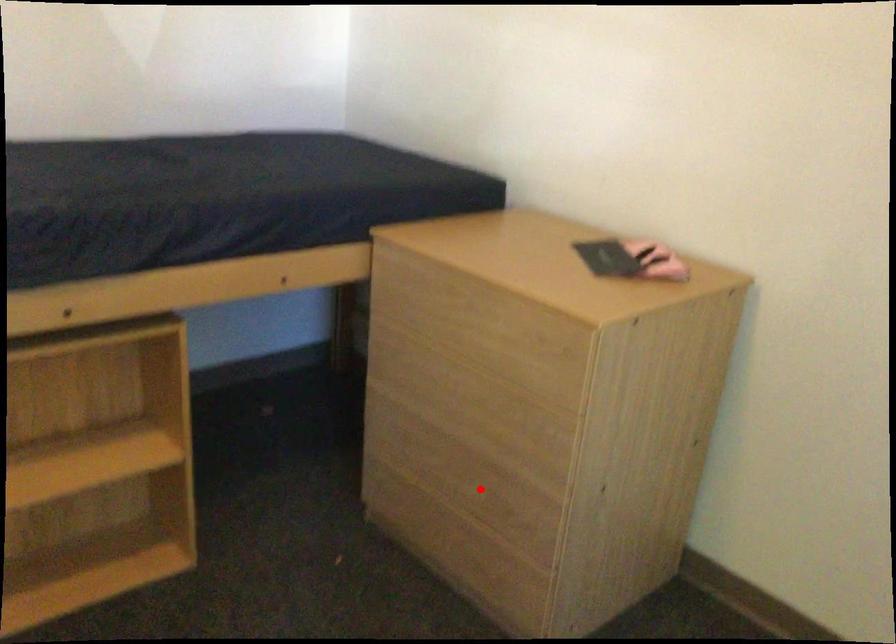
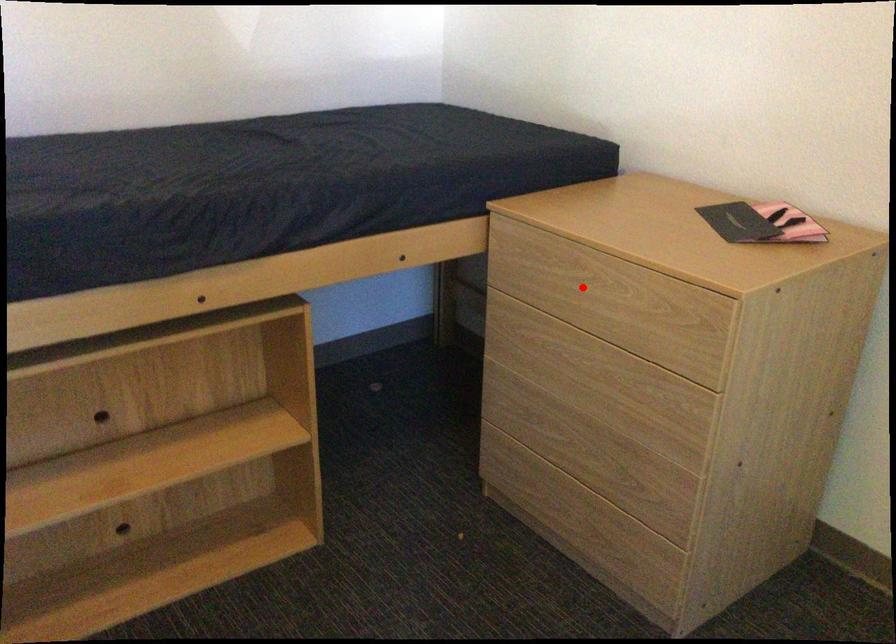
I am providing you with two images of the same scene from different viewpoints. A red point is marked on the first image and another point is marked on the second image. Is the marked point in image1 the same physical position as the marked point in image2?

No